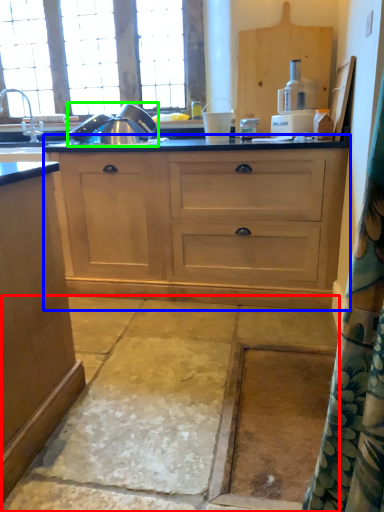
Question: Which is nearer to the concrete (highlighted by a red box)? cupboard (highlighted by a blue box) or appliance (highlighted by a green box).

Choices:
 (A) cupboard
 (B) appliance

Answer: (A)